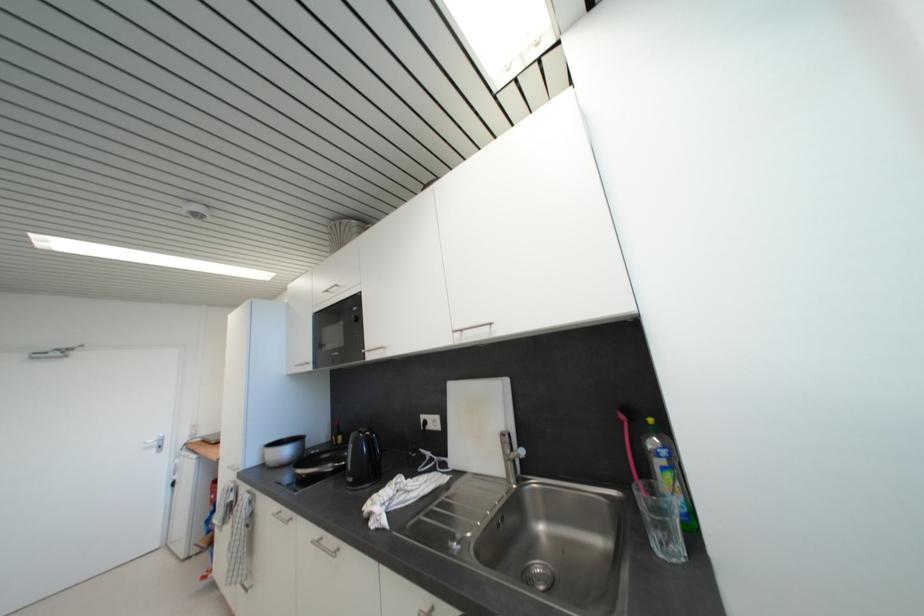
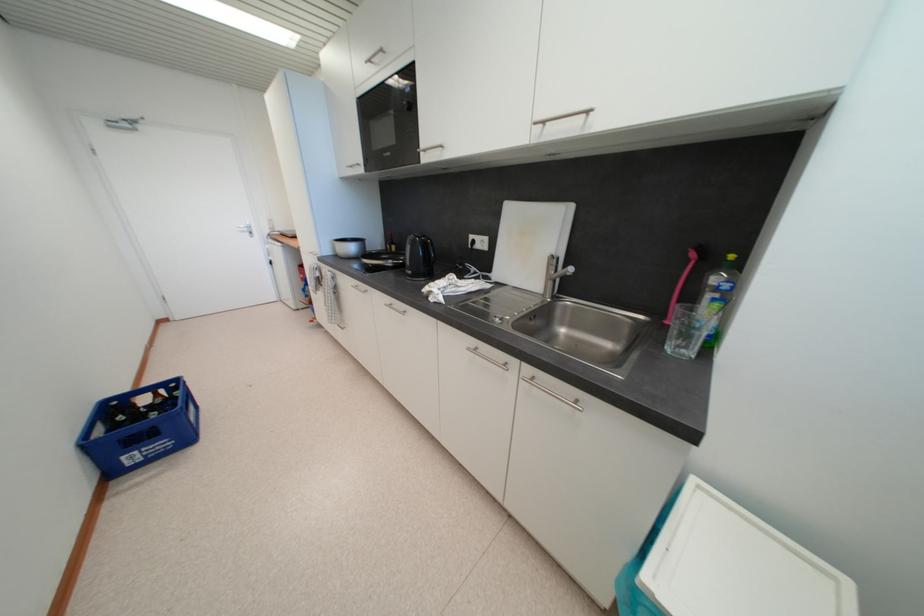
Locate, in the second image, the point that corresponds to pixel 335 468 in the first image.

(395, 264)